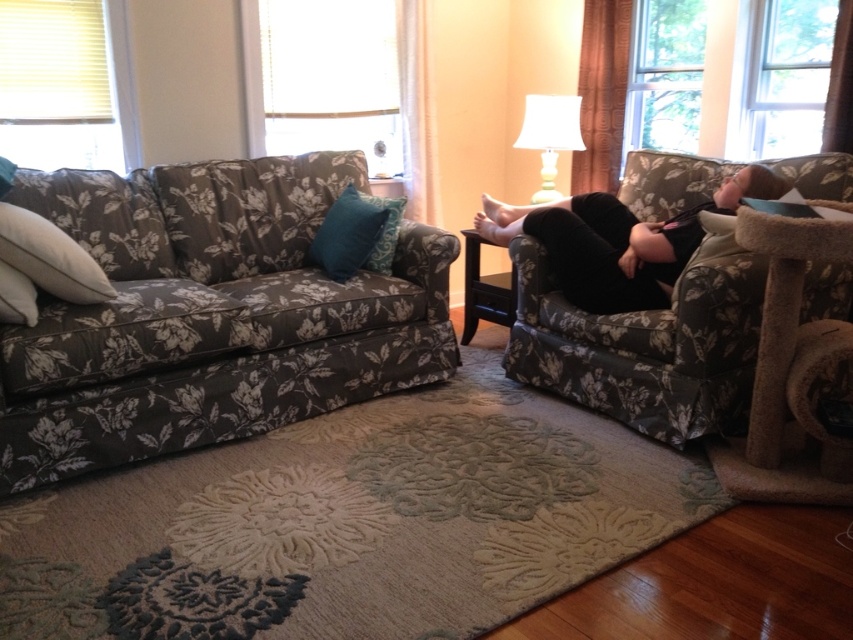
Who is more distant from viewer, [682,237] or [312,257]?

The point [312,257] is behind.

Looking at this image, can you confirm if black velvet pants at right is positioned below teal fabric pillow at center?

Indeed, black velvet pants at right is positioned under teal fabric pillow at center.

What are the coordinates of `black velvet pants at right` in the screenshot? It's located at (618, 241).

Who is taller, black velvet pants at right or white soft pillow at left?

Standing taller between the two is black velvet pants at right.

Does black velvet pants at right appear on the left side of white soft pillow at left?

No, black velvet pants at right is not to the left of white soft pillow at left.

What do you see at coordinates (618, 241) in the screenshot?
I see `black velvet pants at right` at bounding box center [618, 241].

At what (x,y) coordinates should I click in order to perform the action: click on black velvet pants at right. Please return your answer as a coordinate pair (x, y). This screenshot has width=853, height=640. Looking at the image, I should click on (618, 241).

Locate an element on the screen. This screenshot has height=640, width=853. white fabric lampshade at upper right is located at coordinates (549, 136).

Who is lower down, white fabric lampshade at upper right or soft white pillow at left?

Positioned lower is soft white pillow at left.

Is point (555, 154) behind point (4, 289)?

Yes.

Where is `white fabric lampshade at upper right`? The height and width of the screenshot is (640, 853). white fabric lampshade at upper right is located at coordinates (549, 136).